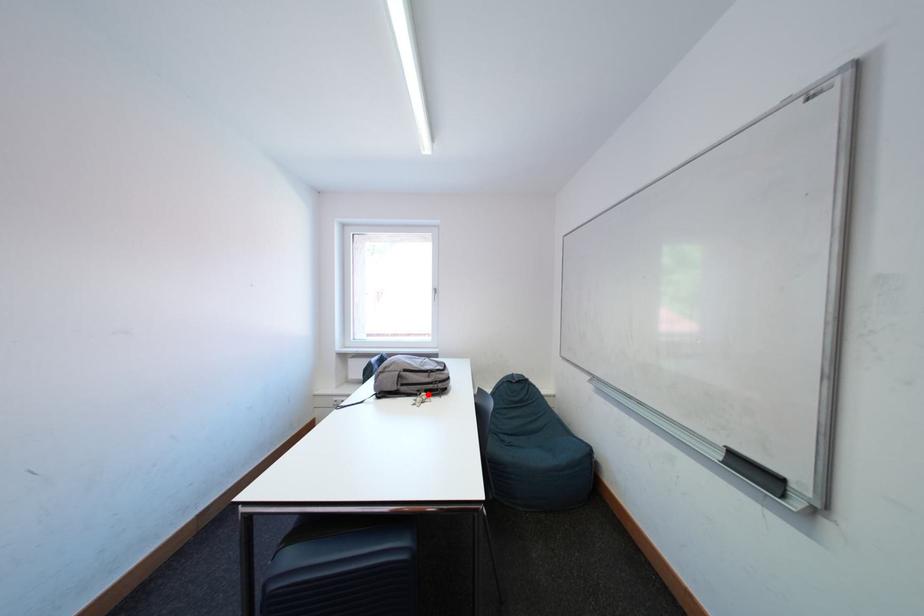
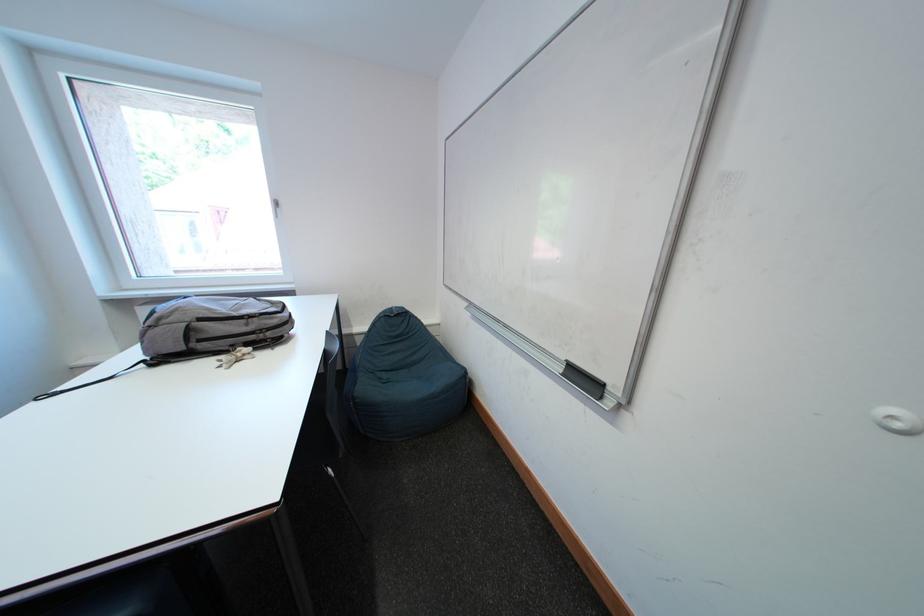
Locate, in the second image, the point that corresponds to the highlighted location in the first image.

(241, 349)